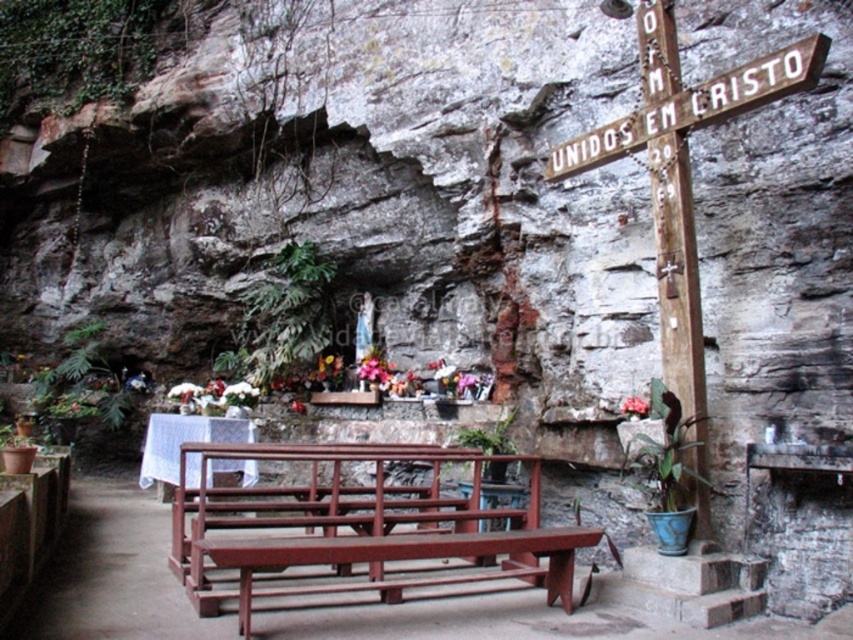
Can you confirm if wooden cross at right is wider than pink fabric flower at center?

Correct, the width of wooden cross at right exceeds that of pink fabric flower at center.

Who is lower down, wooden cross at right or pink fabric flower at center?

pink fabric flower at center is below.

Is point (822, 51) in front of point (619, 406)?

Yes, point (822, 51) is in front of point (619, 406).

At what (x,y) coordinates should I click in order to perform the action: click on wooden cross at right. Please return your answer as a coordinate pair (x, y). This screenshot has height=640, width=853. Looking at the image, I should click on (682, 177).

Is wooden cross at upper right bigger than pink fabric flower at center?

Indeed, wooden cross at upper right has a larger size compared to pink fabric flower at center.

Based on the photo, who is higher up, wooden cross at upper right or pink fabric flower at center?

wooden cross at upper right

Does point (801, 77) lie behind point (641, 397)?

No, it is in front of (641, 397).

Identify the location of wooden cross at upper right. This screenshot has height=640, width=853. (695, 106).

Who is more distant from viewer, (236, 605) or (634, 412)?

The point (634, 412) is more distant.

Who is lower down, rustic wood bench at center or pink fabric flower at center?

rustic wood bench at center is lower down.

This screenshot has height=640, width=853. Find the location of `rustic wood bench at center`. rustic wood bench at center is located at coordinates (360, 531).